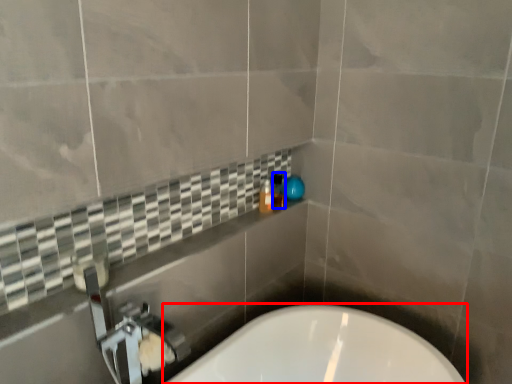
Question: Which of the following is the closest to the observer, bathtub (highlighted by a red box) or toiletry (highlighted by a blue box)?

Choices:
 (A) bathtub
 (B) toiletry

Answer: (A)